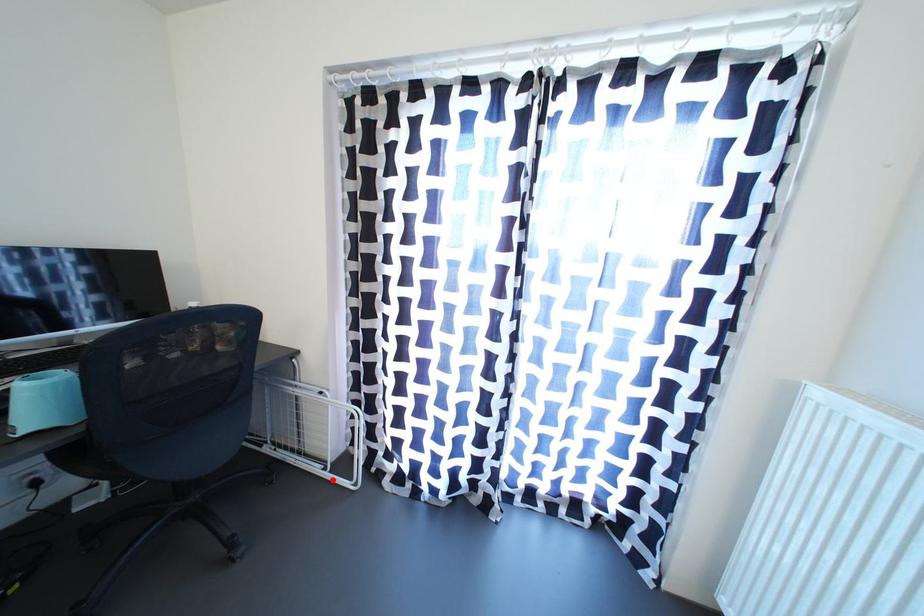
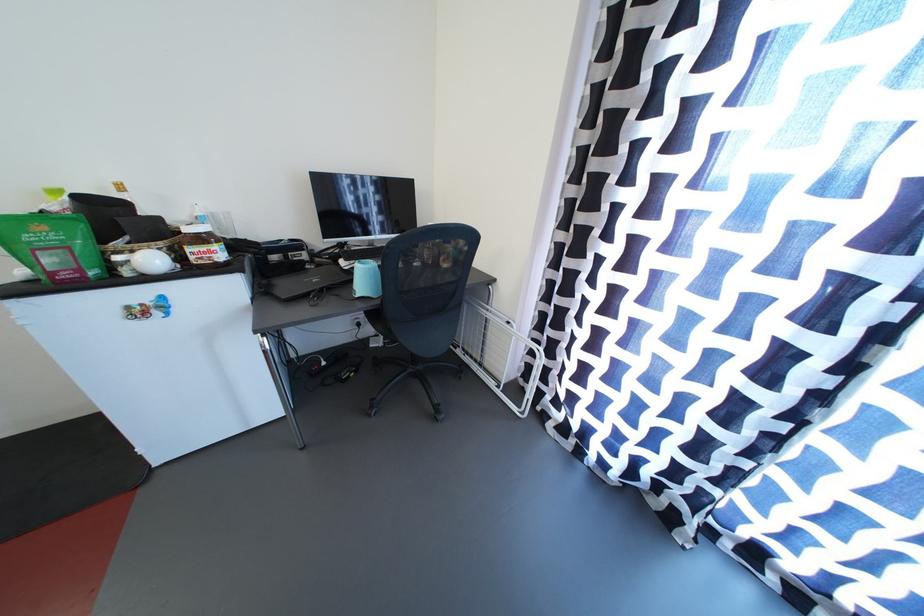
Question: I am providing you with two images of the same scene from different viewpoints. A red point is marked on the first image. Can you still see the location of the red point in image 2?

Choices:
 (A) Yes
 (B) No

Answer: (A)